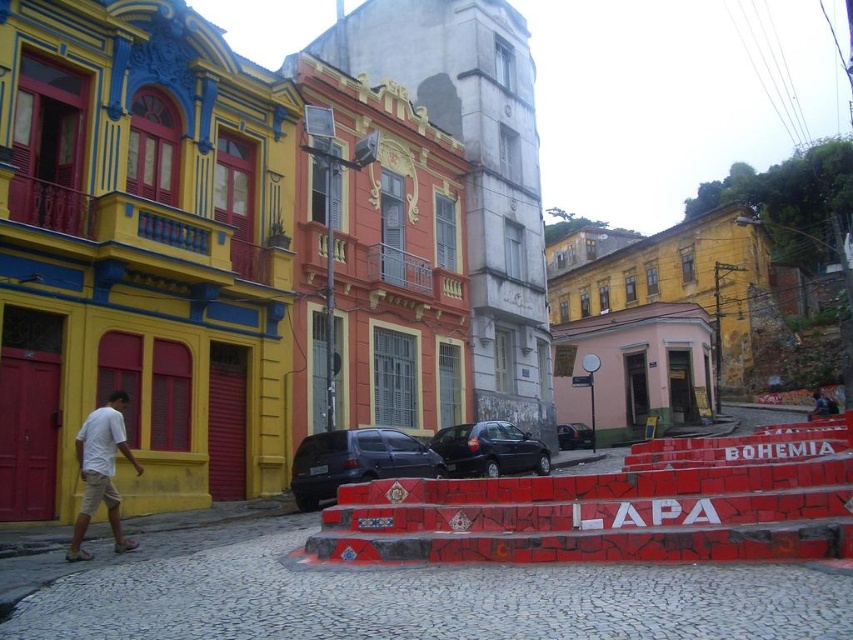
Between red painted stone stairs at lower center and shiny black car at center, which one has more height?

Standing taller between the two is red painted stone stairs at lower center.

Looking at this image, does red painted stone stairs at lower center have a larger size compared to shiny black car at center?

Yes, red painted stone stairs at lower center is bigger than shiny black car at center.

Identify the location of red painted stone stairs at lower center. The image size is (853, 640). (616, 508).

Consider the image. Which is more to the right, white cotton shirt at lower left or shiny black car at center?

From the viewer's perspective, shiny black car at center appears more on the right side.

Can you confirm if white cotton shirt at lower left is positioned above shiny black car at center?

Yes.

Between point (91, 428) and point (526, 433), which one is positioned in front?

Point (91, 428) is in front.

This screenshot has width=853, height=640. Identify the location of white cotton shirt at lower left. (102, 472).

Is shiny black car at center taller than matte black car at center?

Yes, shiny black car at center is taller than matte black car at center.

Does shiny black car at center appear over matte black car at center?

Correct, shiny black car at center is located above matte black car at center.

Find the location of a particular element. The height and width of the screenshot is (640, 853). shiny black car at center is located at coordinates (489, 449).